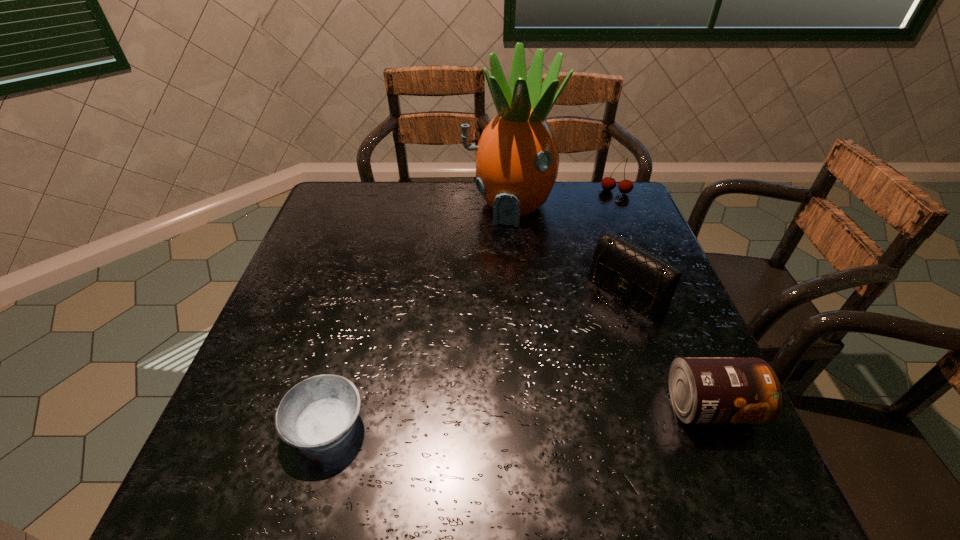
This screenshot has width=960, height=540. Find the location of `free spot on the desktop that is between the shortest object and the can and is positioned on the surface of the cherry`. free spot on the desktop that is between the shortest object and the can and is positioned on the surface of the cherry is located at coordinates (524, 416).

Where is `free spot on the desktop that is between the ashtray and the can and is positioned on the front flap of the clutch bag`? free spot on the desktop that is between the ashtray and the can and is positioned on the front flap of the clutch bag is located at coordinates (466, 420).

The height and width of the screenshot is (540, 960). I want to click on free space on the desktop that is between the shortest object and the can and is positioned at the entrance of the second object from left to right, so click(x=466, y=420).